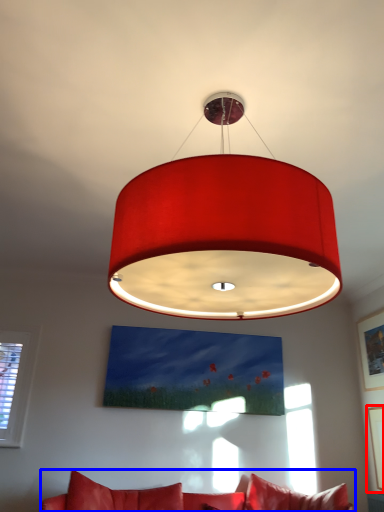
Question: Which point is further to the camera, picture frame (highlighted by a red box) or studio couch (highlighted by a blue box)?

Choices:
 (A) picture frame
 (B) studio couch

Answer: (A)